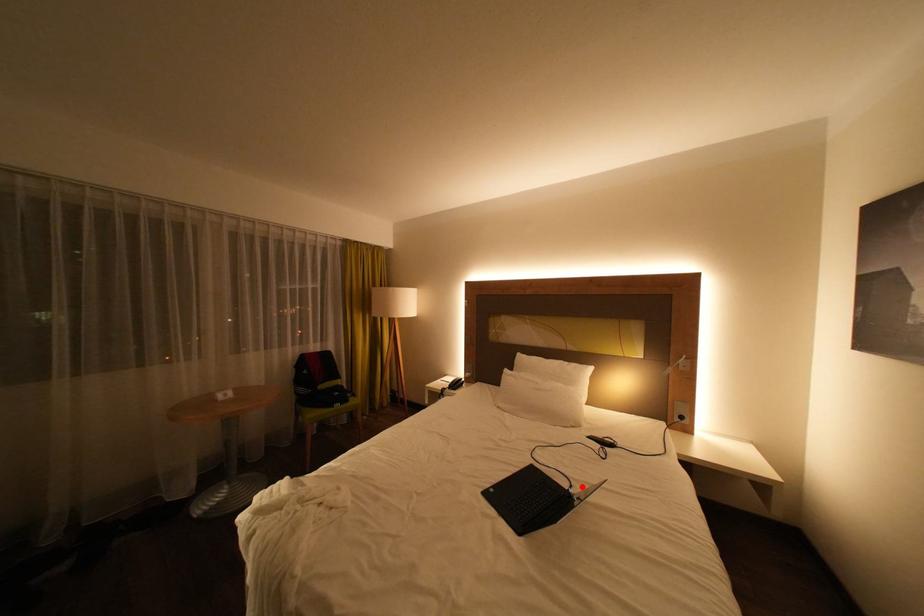
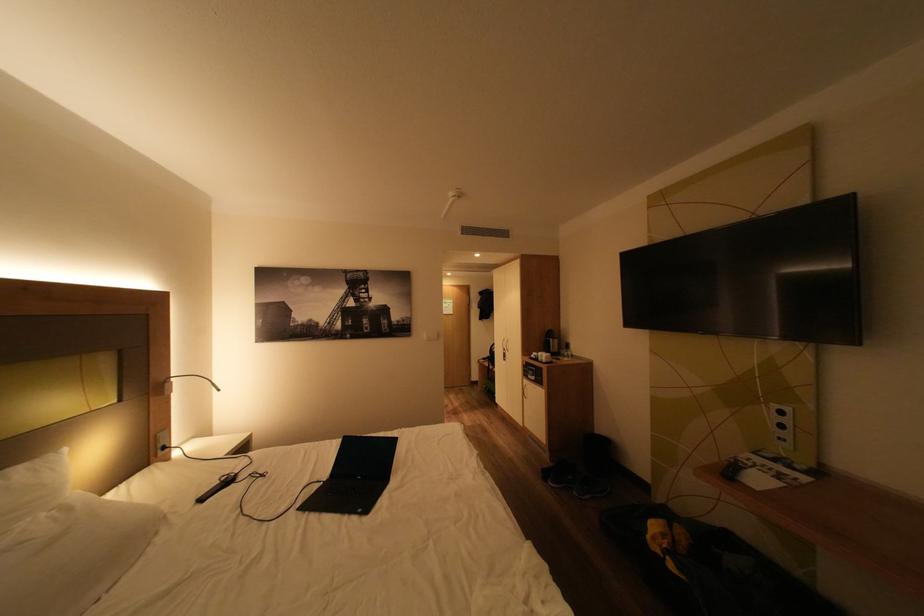
Locate, in the second image, the point that corresponds to the highlighted location in the first image.

(329, 483)